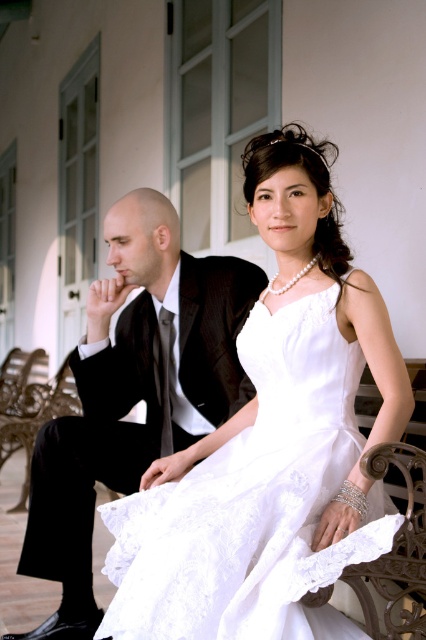
You are a photographer taking a photo of the couple. The white lace dress at center and the matte black suit at left are both in the frame. Which one is positioned closer to the camera?

The white lace dress at center is closer to the viewer than the matte black suit at left, so it will appear larger in the photo.